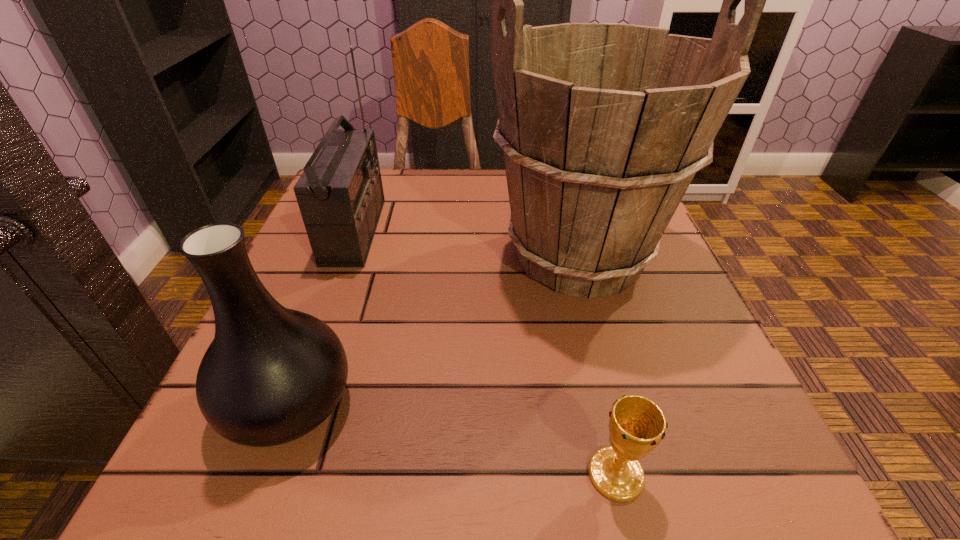
Where is `free space between the second tallest object and the bucket`? This screenshot has height=540, width=960. free space between the second tallest object and the bucket is located at coordinates (467, 244).

At what (x,y) coordinates should I click in order to perform the action: click on free space between the third tallest object and the shortest object. Please return your answer as a coordinate pair (x, y). Image resolution: width=960 pixels, height=540 pixels. Looking at the image, I should click on (452, 438).

Find the location of a particular element. The image size is (960, 540). the second closest object to the bucket is located at coordinates pyautogui.click(x=637, y=425).

The width and height of the screenshot is (960, 540). What are the coordinates of `object that is the second nearest to the second shortest object` in the screenshot? It's located at (340, 195).

Identify the location of vacant space that satisfies the following two spatial constraints: 1. on the front panel of the third shortest object; 2. on the back side of the tallest object. Image resolution: width=960 pixels, height=540 pixels. (346, 256).

Locate an element on the screen. The height and width of the screenshot is (540, 960). vacant space that satisfies the following two spatial constraints: 1. on the back side of the tallest object; 2. on the right side of the vase is located at coordinates (344, 256).

Locate an element on the screen. The height and width of the screenshot is (540, 960). free point that satisfies the following two spatial constraints: 1. on the front panel of the third shortest object; 2. on the right side of the bucket is located at coordinates (346, 256).

This screenshot has width=960, height=540. Identify the location of vacant area in the image that satisfies the following two spatial constraints: 1. on the back side of the chalice; 2. on the front panel of the radio receiver. (559, 231).

Locate an element on the screen. The height and width of the screenshot is (540, 960). vacant space that satisfies the following two spatial constraints: 1. on the front panel of the second tallest object; 2. on the right side of the chalice is located at coordinates (266, 474).

Locate an element on the screen. The image size is (960, 540). vacant area that satisfies the following two spatial constraints: 1. on the front panel of the bucket; 2. on the left side of the third shortest object is located at coordinates click(346, 256).